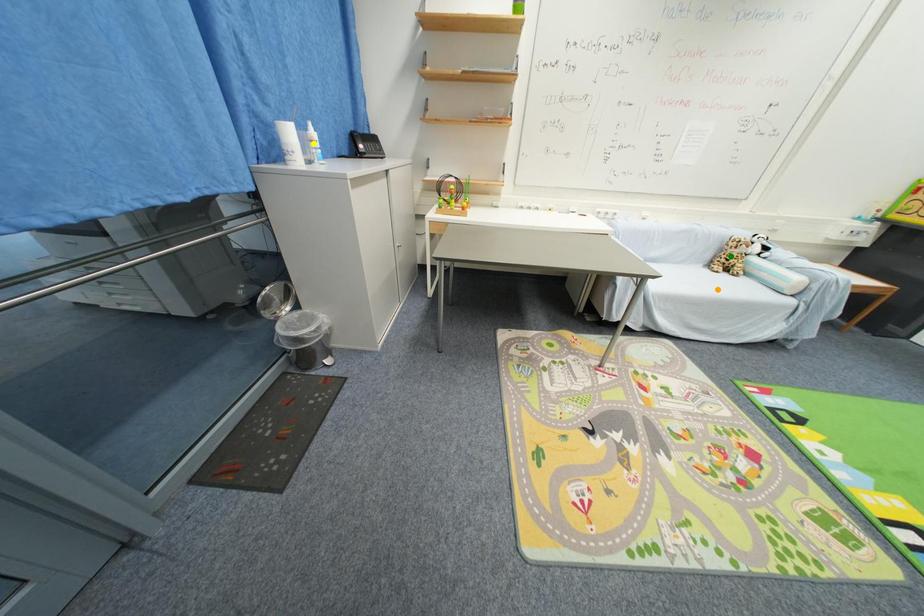
Looking at this image, order these from nearest to farthest:
orange point, green point, yellow point

yellow point < orange point < green point